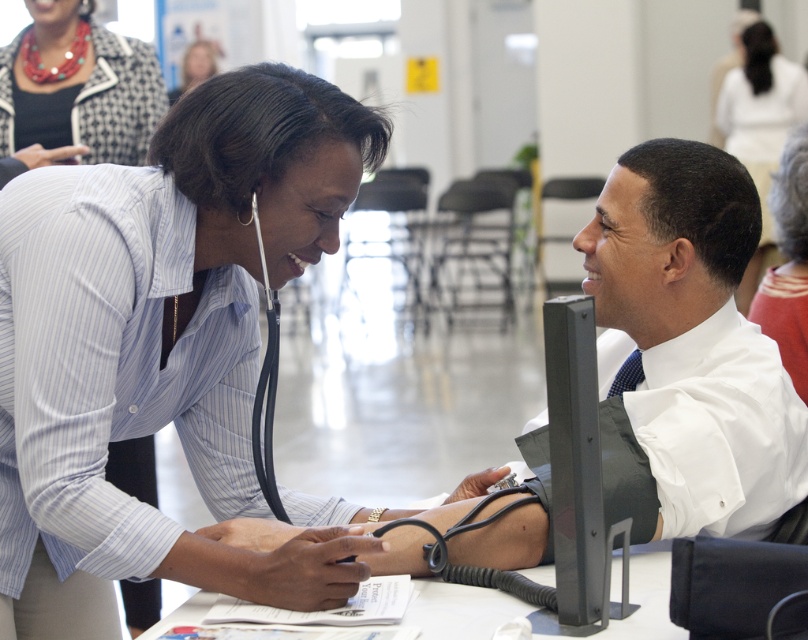
Is white fabric shirt at upper right taller than smooth skin face at upper center?

Yes.

Is point (739, 120) farther from camera compared to point (202, 70)?

No, (739, 120) is closer to viewer.

Image resolution: width=808 pixels, height=640 pixels. Find the location of `white fabric shirt at upper right`. white fabric shirt at upper right is located at coordinates (760, 124).

Image resolution: width=808 pixels, height=640 pixels. Identify the location of gray striped shirt at upper right. (788, 262).

Between gray striped shirt at upper right and smooth skin face at upper center, which one appears on the left side from the viewer's perspective?

smooth skin face at upper center is more to the left.

Describe the element at coordinates (788, 262) in the screenshot. I see `gray striped shirt at upper right` at that location.

This screenshot has width=808, height=640. I want to click on gray striped shirt at upper right, so click(x=788, y=262).

Is matte black necklace at upper left taller than gray striped shirt at upper right?

In fact, matte black necklace at upper left may be shorter than gray striped shirt at upper right.

Does matte black necklace at upper left have a greater width compared to gray striped shirt at upper right?

Yes.

Is point (108, 38) farther from viewer compared to point (781, 250)?

Yes, it is.

This screenshot has width=808, height=640. I want to click on matte black necklace at upper left, so click(118, 99).